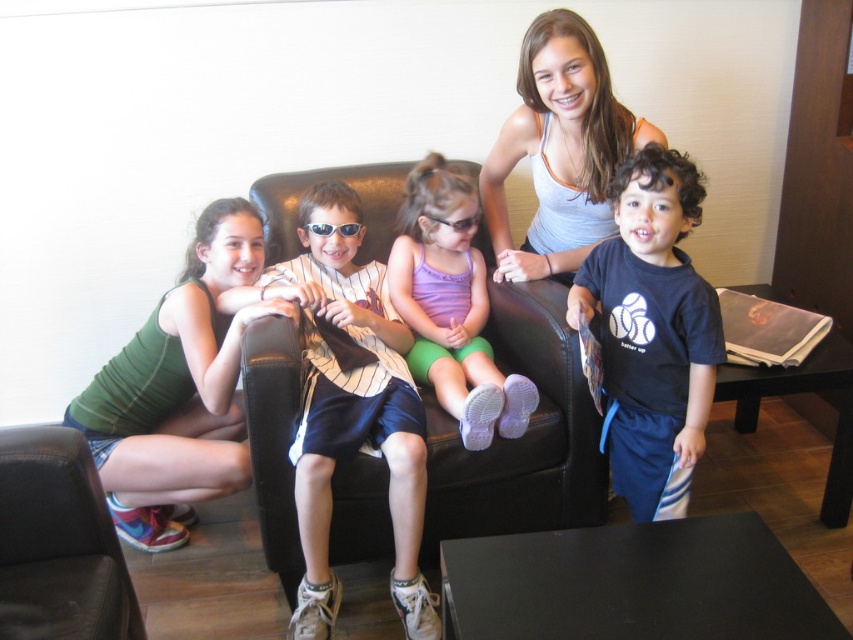
You are standing at the center of the living room and see two points marked in the image. The first point is at coordinates point (215,406) and the second point is at point (567,156). Which point is closer to you?

Point (215,406) is in front of point (567,156), so it is closer to you.

You are designing a new clothing line and need to know the size relationship between the green fabric tank top at lower left and the white tank top at upper center. Which one is bigger?

The green fabric tank top at lower left is larger in size than the white tank top at upper center.

You are a photographer trying to capture a closeup of the white striped shirt at center and the purple fabric shorts at center. Since you can only focus on one object at a time, which one should you focus on first to ensure the other is also in focus?

The white striped shirt at center is in front of the purple fabric shorts at center, so focusing on the white striped shirt at center first will ensure the purple fabric shorts at center is also in focus.